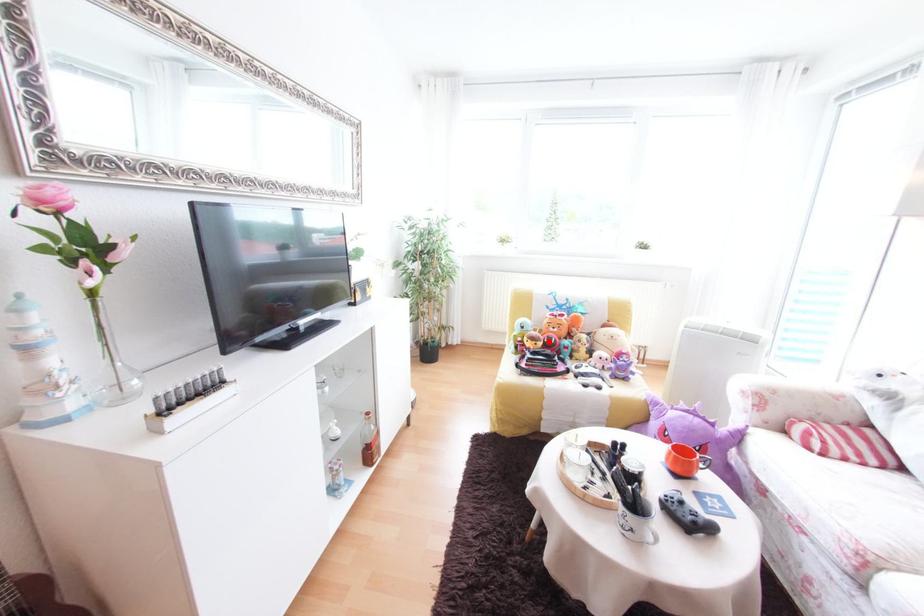
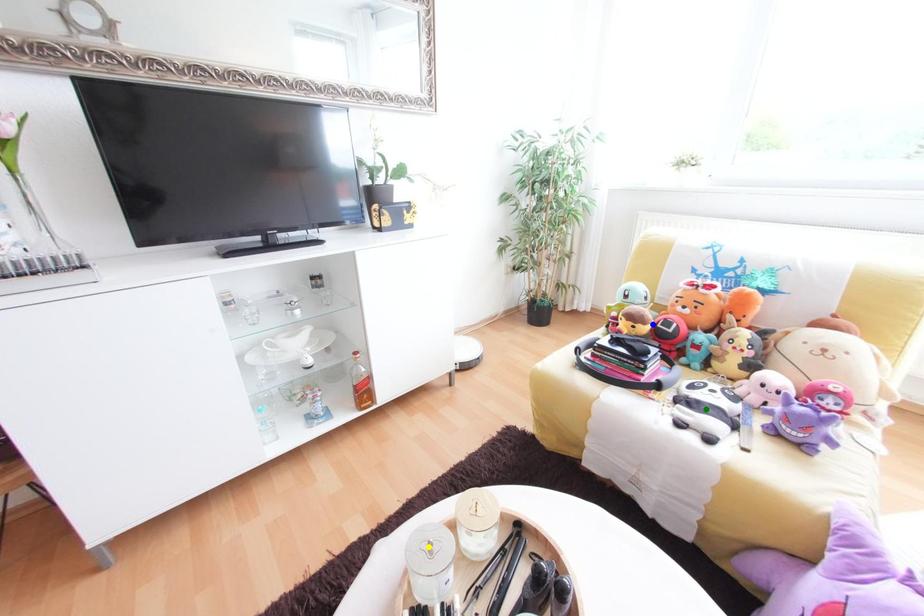
Question: I am providing you with two images of the same scene from different viewpoints. A red point is marked on the first image. You are given multiple points on the second image. Which point in image 2 represents the same 3d spot as the red point in image 1?

Choices:
 (A) yellow point
 (B) green point
 (C) blue point

Answer: (C)